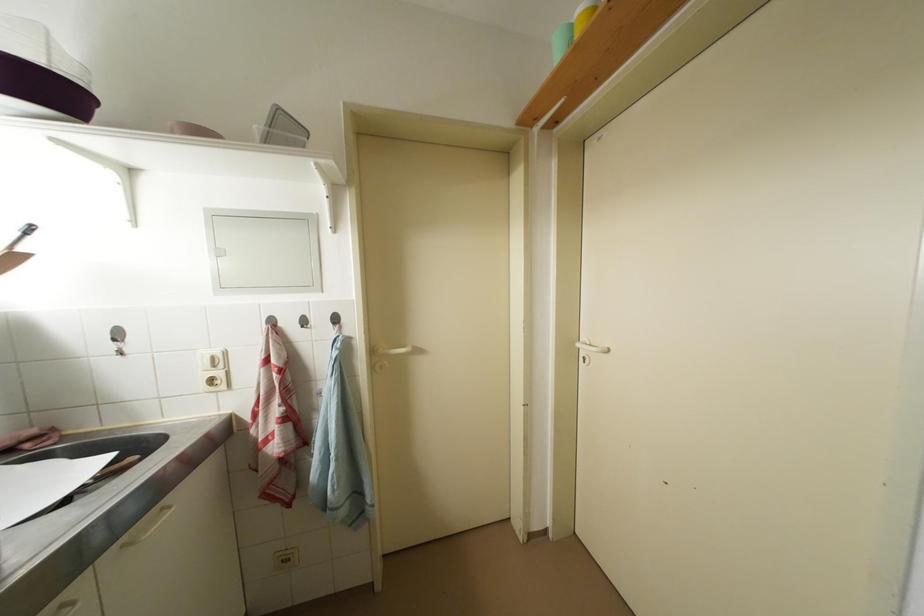
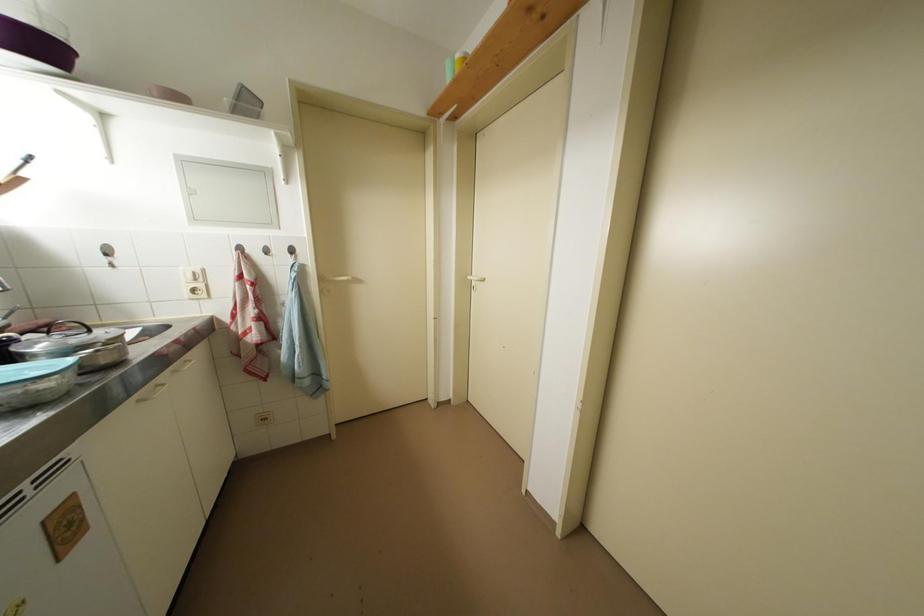
Question: In a continuous first-person perspective shot, in which direction is the camera moving?

Choices:
 (A) Left
 (B) Right
 (C) Forward
 (D) Backward

Answer: (D)